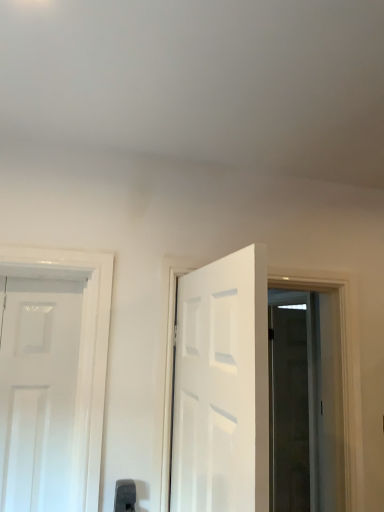
Question: Is white glossy door at center a part of transparent glass door at right?

Choices:
 (A) yes
 (B) no

Answer: (B)

Question: From a real-world perspective, is transparent glass door at right located higher than white glossy door at center?

Choices:
 (A) yes
 (B) no

Answer: (B)

Question: Would you consider transparent glass door at right to be distant from white glossy door at center?

Choices:
 (A) no
 (B) yes

Answer: (A)

Question: Is transparent glass door at right thinner than white glossy door at center?

Choices:
 (A) no
 (B) yes

Answer: (A)

Question: From the image's perspective, does transparent glass door at right appear higher than white glossy door at center?

Choices:
 (A) no
 (B) yes

Answer: (A)

Question: Does transparent glass door at right have a larger size compared to white glossy door at center?

Choices:
 (A) yes
 (B) no

Answer: (A)

Question: Are black plastic door handle at lower center and transparent glass door at right beside each other?

Choices:
 (A) no
 (B) yes

Answer: (A)

Question: Is black plastic door handle at lower center completely or partially outside of transparent glass door at right?

Choices:
 (A) yes
 (B) no

Answer: (A)

Question: Is transparent glass door at right inside black plastic door handle at lower center?

Choices:
 (A) no
 (B) yes

Answer: (A)

Question: Is black plastic door handle at lower center facing away from transparent glass door at right?

Choices:
 (A) no
 (B) yes

Answer: (A)

Question: Considering the relative sizes of black plastic door handle at lower center and transparent glass door at right in the image provided, is black plastic door handle at lower center taller than transparent glass door at right?

Choices:
 (A) no
 (B) yes

Answer: (A)

Question: Is black plastic door handle at lower center bigger than transparent glass door at right?

Choices:
 (A) yes
 (B) no

Answer: (B)

Question: Could you tell me if white glossy door at center is turned towards black plastic door handle at lower center?

Choices:
 (A) yes
 (B) no

Answer: (B)